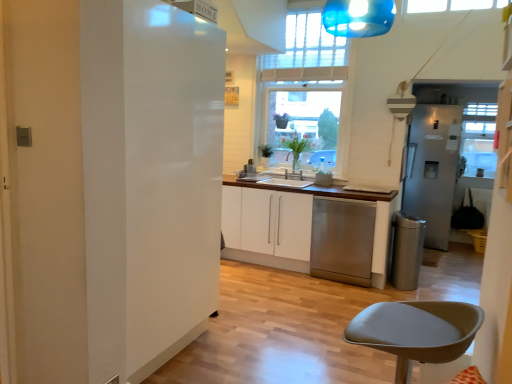
Where is `vacant space to the right of white glossy refrigerator at left, placed as the 1th fridge when sorted from left to right`? The height and width of the screenshot is (384, 512). vacant space to the right of white glossy refrigerator at left, placed as the 1th fridge when sorted from left to right is located at coordinates pyautogui.click(x=247, y=360).